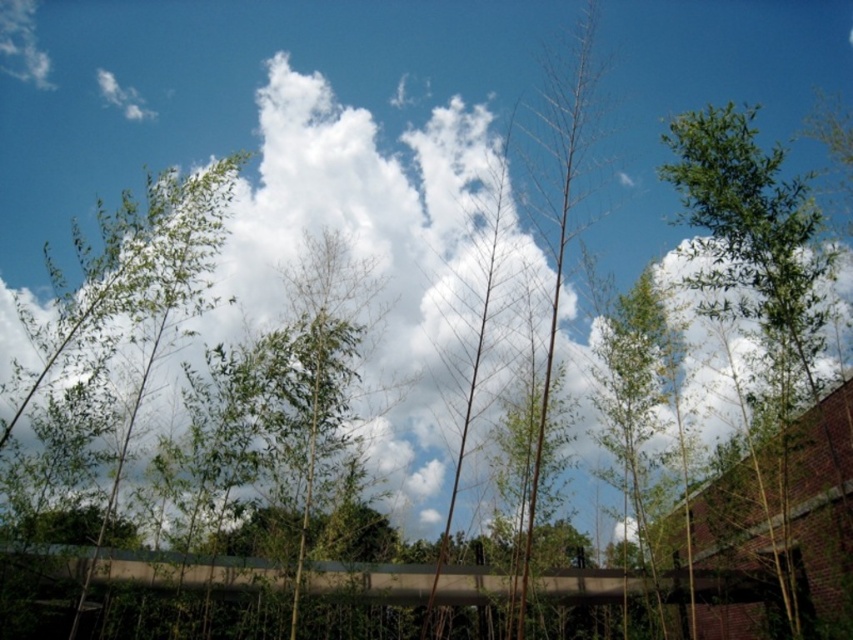
Question: Is white fluffy cloud at upper center above green leafy tree at upper right?

Choices:
 (A) yes
 (B) no

Answer: (B)

Question: Which point is closer to the camera?

Choices:
 (A) green leafy tree at left
 (B) green leafy tree at upper right
 (C) white fluffy cloud at upper center

Answer: (B)

Question: Which object appears farthest from the camera in this image?

Choices:
 (A) green leafy tree at upper right
 (B) green leafy tree at left

Answer: (B)

Question: Can you confirm if white fluffy cloud at upper center is positioned to the left of green leafy tree at upper right?

Choices:
 (A) no
 (B) yes

Answer: (B)

Question: Among these objects, which one is farthest from the camera?

Choices:
 (A) green leafy tree at left
 (B) green leafy tree at upper right
 (C) white fluffy cloud at upper center

Answer: (C)

Question: Is white fluffy cloud at upper center further to camera compared to green leafy tree at left?

Choices:
 (A) no
 (B) yes

Answer: (B)